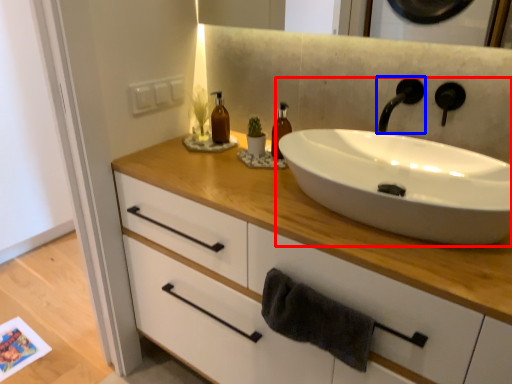
Question: Among these objects, which one is nearest to the camera, sink (highlighted by a red box) or tap (highlighted by a blue box)?

Choices:
 (A) sink
 (B) tap

Answer: (A)